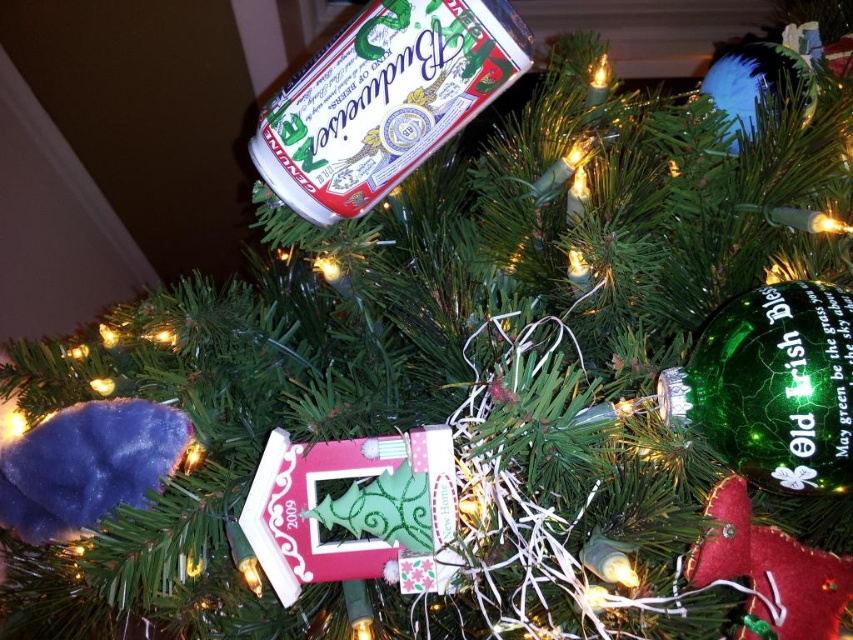
Is metallic silver can at upper center positioned in front of green glass ornament at upper right?

No.

Between point (355, 17) and point (828, 429), which one is positioned in front?

Positioned in front is point (828, 429).

Measure the distance between point (425,12) and camera.

Point (425,12) is 23.76 inches away from camera.

This screenshot has width=853, height=640. I want to click on metallic silver can at upper center, so click(x=384, y=100).